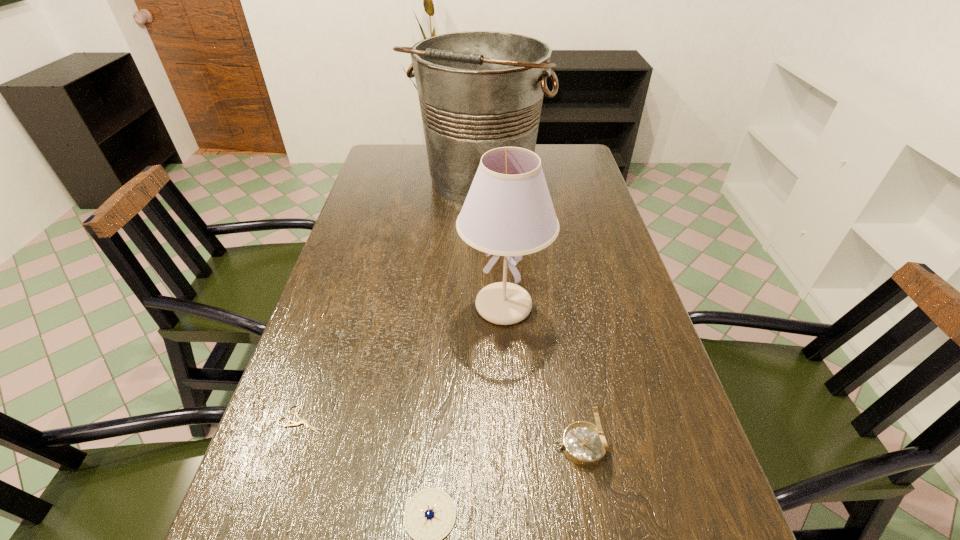
Identify the location of bucket. Image resolution: width=960 pixels, height=540 pixels. (478, 90).

This screenshot has height=540, width=960. I want to click on the tallest object, so click(x=478, y=90).

Where is `lampshade`? The height and width of the screenshot is (540, 960). lampshade is located at coordinates (508, 211).

This screenshot has height=540, width=960. I want to click on the second farthest object, so click(508, 211).

Locate an element on the screen. The width and height of the screenshot is (960, 540). the taller compass is located at coordinates 585,444.

The height and width of the screenshot is (540, 960). In order to click on the farther compass in this screenshot , I will do `click(585, 444)`.

Where is `the leftmost object`? the leftmost object is located at coordinates (301, 421).

This screenshot has height=540, width=960. What are the coordinates of `the shortest object` in the screenshot? It's located at 301,421.

Identify the location of vacant region located 0.080m on the right of the farthest object. Image resolution: width=960 pixels, height=540 pixels. (569, 180).

The height and width of the screenshot is (540, 960). Find the location of `vacant space located 0.170m on the right of the fourth nearest object`. vacant space located 0.170m on the right of the fourth nearest object is located at coordinates (617, 306).